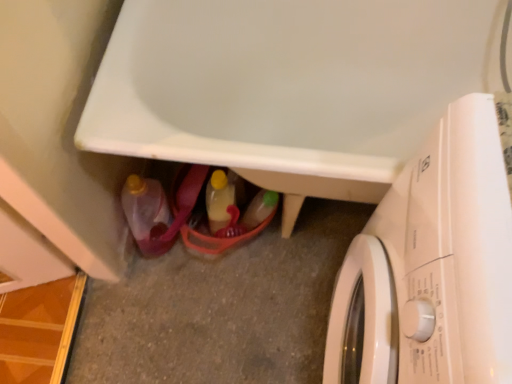
Question: Is white glossy bathtub at lower center positioned with its back to matte plastic bottle at lower left, which is the 1th bottle in left-to-right order?

Choices:
 (A) no
 (B) yes

Answer: (A)

Question: Considering the relative positions of white glossy bathtub at lower center and matte plastic bottle at lower left, which is the 1th bottle in left-to-right order, in the image provided, is white glossy bathtub at lower center to the right of matte plastic bottle at lower left, which is the 1th bottle in left-to-right order, from the viewer's perspective?

Choices:
 (A) yes
 (B) no

Answer: (A)

Question: From a real-world perspective, is white glossy bathtub at lower center under matte plastic bottle at lower left, which appears as the second bottle when viewed from the right?

Choices:
 (A) yes
 (B) no

Answer: (B)

Question: Is white glossy bathtub at lower center wider than matte plastic bottle at lower left, which is the 1th bottle in left-to-right order?

Choices:
 (A) yes
 (B) no

Answer: (A)

Question: From a real-world perspective, is white glossy bathtub at lower center positioned over matte plastic bottle at lower left, which is the 1th bottle in left-to-right order, based on gravity?

Choices:
 (A) yes
 (B) no

Answer: (A)

Question: Is translucent plastic bottle at center, marked as the 1th bottle in a right-to-left arrangement, in front of or behind white glossy bathtub at lower center in the image?

Choices:
 (A) behind
 (B) front

Answer: (A)

Question: Considering the positions of translucent plastic bottle at center, marked as the 1th bottle in a right-to-left arrangement, and white glossy bathtub at lower center in the image, is translucent plastic bottle at center, marked as the 1th bottle in a right-to-left arrangement, wider or thinner than white glossy bathtub at lower center?

Choices:
 (A) wide
 (B) thin

Answer: (B)

Question: Considering the positions of translucent plastic bottle at center, acting as the second bottle starting from the left, and white glossy bathtub at lower center in the image, is translucent plastic bottle at center, acting as the second bottle starting from the left, taller or shorter than white glossy bathtub at lower center?

Choices:
 (A) short
 (B) tall

Answer: (A)

Question: Is translucent plastic bottle at center, acting as the second bottle starting from the left, situated inside white glossy bathtub at lower center or outside?

Choices:
 (A) inside
 (B) outside

Answer: (A)

Question: From the image's perspective, relative to translucent plastic bottle at center, marked as the 1th bottle in a right-to-left arrangement, is matte plastic bottle at lower left, which appears as the second bottle when viewed from the right, above or below?

Choices:
 (A) above
 (B) below

Answer: (B)

Question: Is matte plastic bottle at lower left, which is the 1th bottle in left-to-right order, in front of or behind translucent plastic bottle at center, acting as the second bottle starting from the left, in the image?

Choices:
 (A) front
 (B) behind

Answer: (A)

Question: In the image, is matte plastic bottle at lower left, which is the 1th bottle in left-to-right order, on the left side or the right side of translucent plastic bottle at center, marked as the 1th bottle in a right-to-left arrangement?

Choices:
 (A) left
 (B) right

Answer: (A)

Question: Considering the positions of matte plastic bottle at lower left, which is the 1th bottle in left-to-right order, and translucent plastic bottle at center, acting as the second bottle starting from the left, in the image, is matte plastic bottle at lower left, which is the 1th bottle in left-to-right order, taller or shorter than translucent plastic bottle at center, acting as the second bottle starting from the left,?

Choices:
 (A) short
 (B) tall

Answer: (B)

Question: From a real-world perspective, relative to white glossy washing machine at lower right, is white glossy bathtub at lower center vertically above or below?

Choices:
 (A) above
 (B) below

Answer: (B)

Question: Is white glossy bathtub at lower center to the left or to the right of white glossy washing machine at lower right in the image?

Choices:
 (A) left
 (B) right

Answer: (A)